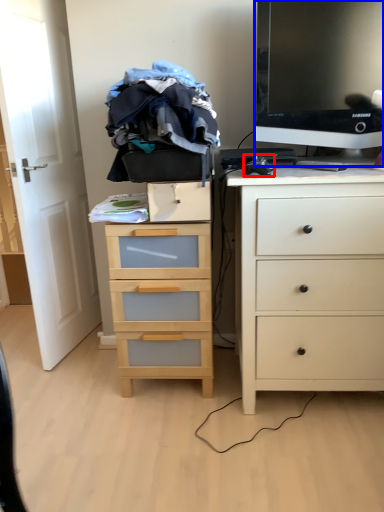
Question: Which object appears closest to the camera in this image, computer mouse (highlighted by a red box) or television (highlighted by a blue box)?

Choices:
 (A) computer mouse
 (B) television

Answer: (B)